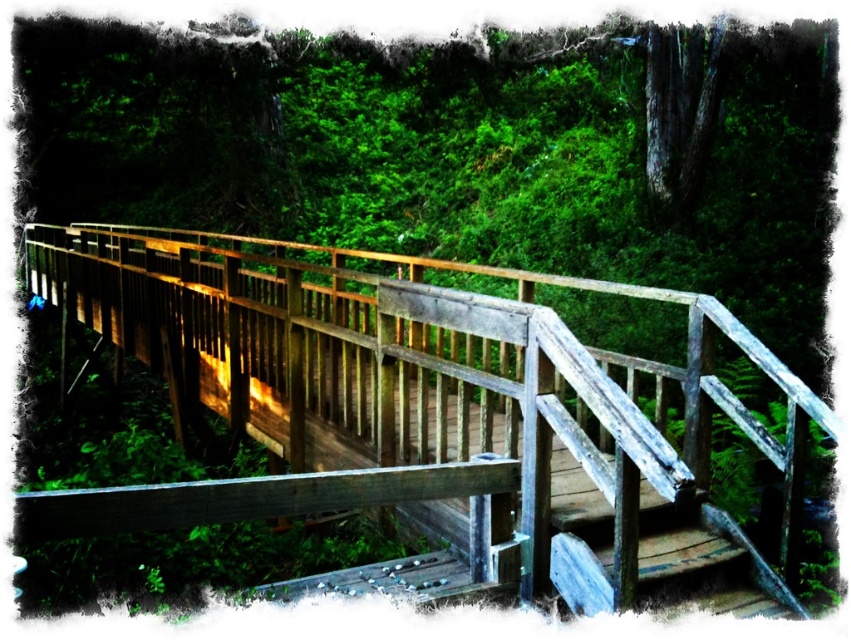
You are standing at the origin point of the image coordinate system. The origin is at the bottom left corner of the image. You want to walk to the weathered wood bridge at center. In which direction should you move?

Since the weathered wood bridge at center is located at point [430,412] in the image coordinate system, you should move to the right and slightly upwards from the origin to reach it.

You are standing on the weathered wood stairs at center and want to reach the weathered wood bridge at center. Which direction should you move to get there?

The weathered wood bridge at center is located above the weathered wood stairs at center, so you should move upward to reach it.

You are a photographer standing at the base of a hill. You want to take a photo of the weathered wood bridge at center. If your camera has a maximum zoom range of 3 meters, will you be able to capture the entire bridge without moving closer?

The weathered wood bridge at center is 3.22 meters away from the camera. Since the camera can only zoom up to 3 meters, you will not be able to capture the entire bridge without moving closer.